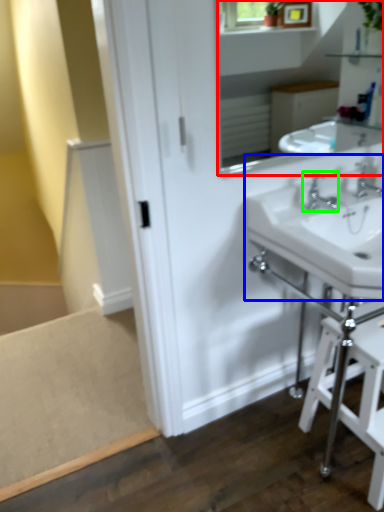
Question: Considering the real-world distances, which object is farthest from mirror (highlighted by a red box)? sink (highlighted by a blue box) or tap (highlighted by a green box)?

Choices:
 (A) sink
 (B) tap

Answer: (B)